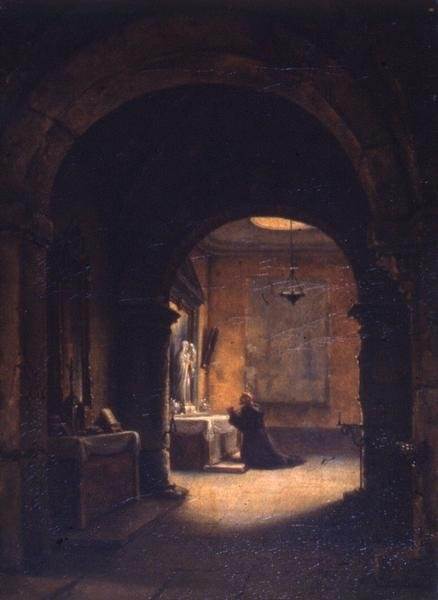
Where is `mirror`? The height and width of the screenshot is (600, 438). mirror is located at coordinates (76, 383).